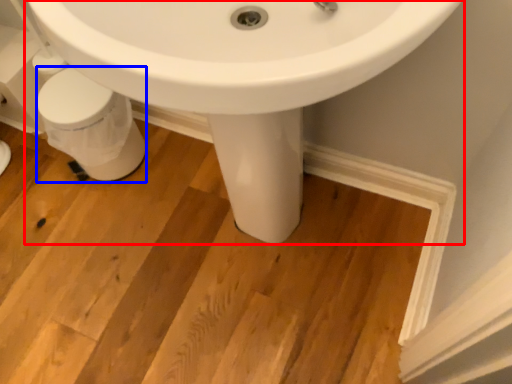
Question: Which of the following is the closest to the observer, sink (highlighted by a red box) or porcelain (highlighted by a blue box)?

Choices:
 (A) sink
 (B) porcelain

Answer: (A)